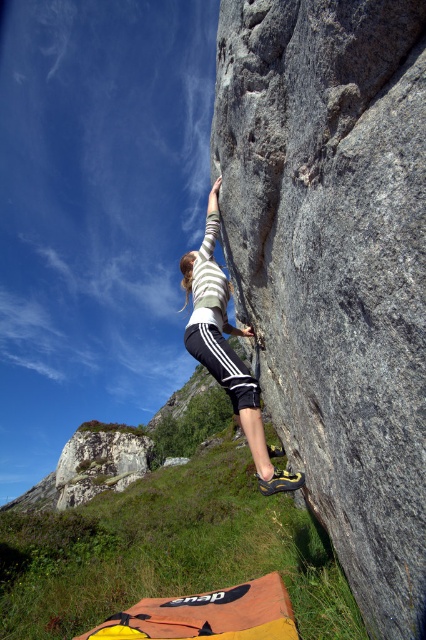
Question: Is gray rough rock at center thinner than white striped shirt at center?

Choices:
 (A) yes
 (B) no

Answer: (A)

Question: Is the position of gray rough rock at center more distant than that of white striped shirt at center?

Choices:
 (A) yes
 (B) no

Answer: (B)

Question: Which point appears farthest from the camera in this image?

Choices:
 (A) (423, 337)
 (B) (215, 292)

Answer: (B)

Question: Which point appears farthest from the camera in this image?

Choices:
 (A) (357, 538)
 (B) (256, 476)

Answer: (B)

Question: Is gray rough rock at center positioned behind white striped shirt at center?

Choices:
 (A) yes
 (B) no

Answer: (B)